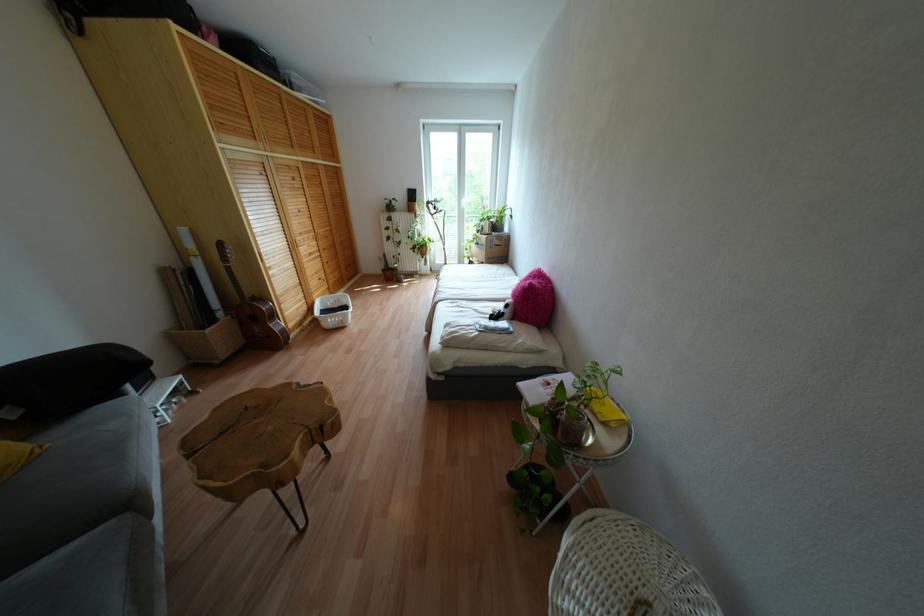
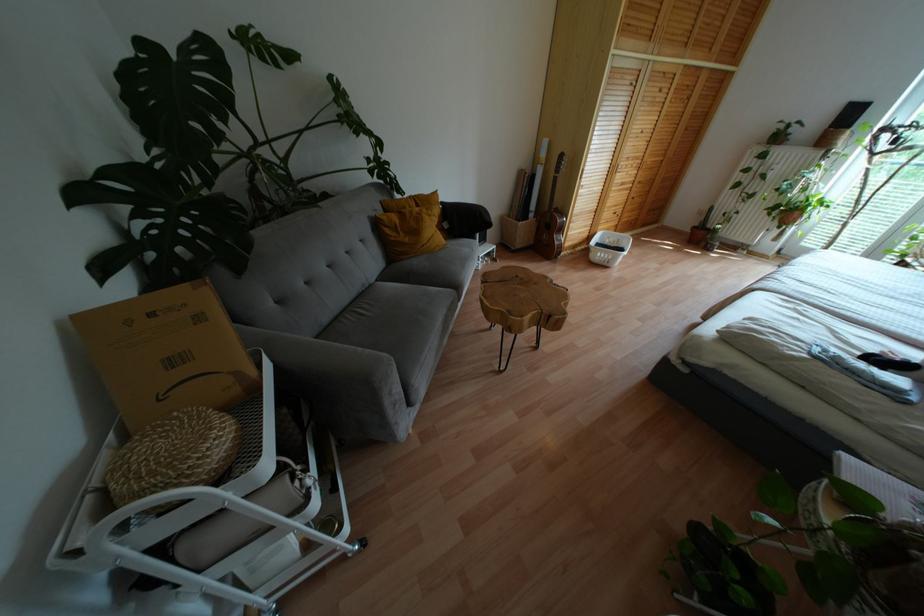
In the second image, find the point that corresponds to pixel 273 314 in the first image.

(560, 229)